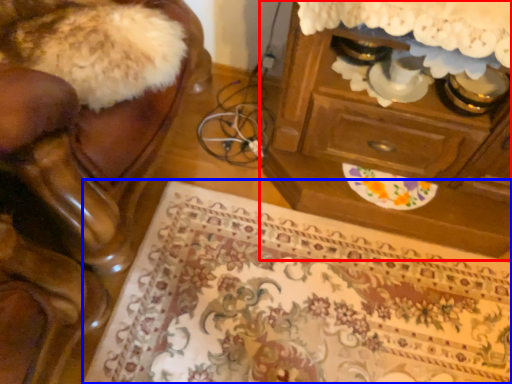
Question: Which object is closer to the camera taking this photo, chest of drawers (highlighted by a red box) or mat (highlighted by a blue box)?

Choices:
 (A) chest of drawers
 (B) mat

Answer: (A)